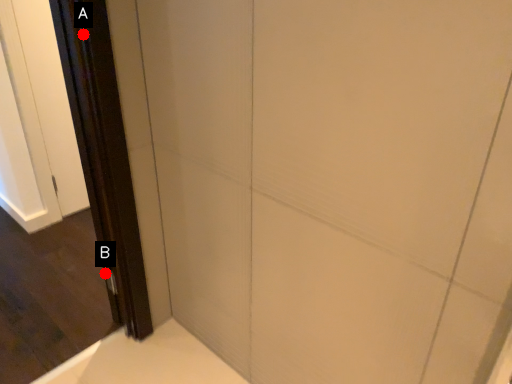
Question: Two points are circled on the image, labeled by A and B beside each circle. Which point is closer to the camera?

Choices:
 (A) A is closer
 (B) B is closer

Answer: (A)